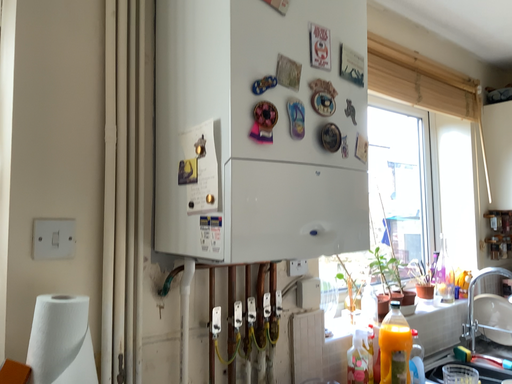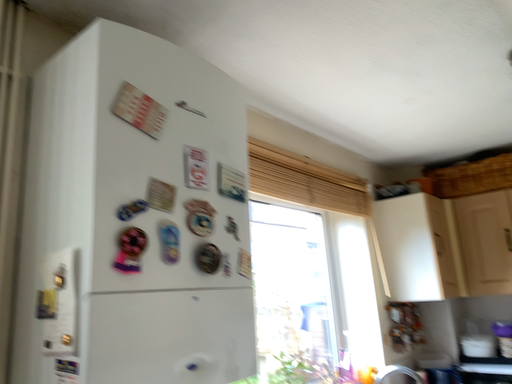
Question: How did the camera likely rotate when shooting the video?

Choices:
 (A) rotated right
 (B) rotated left

Answer: (A)